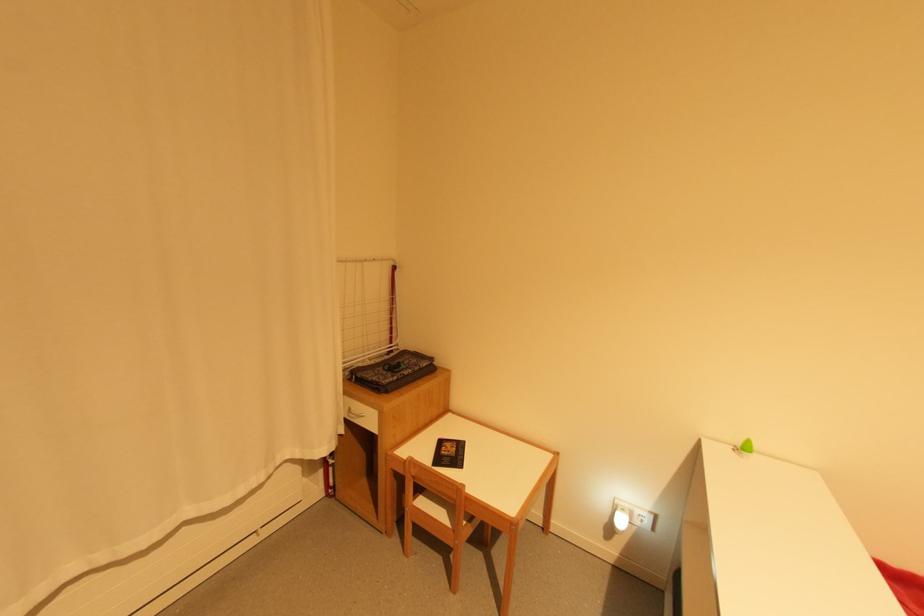
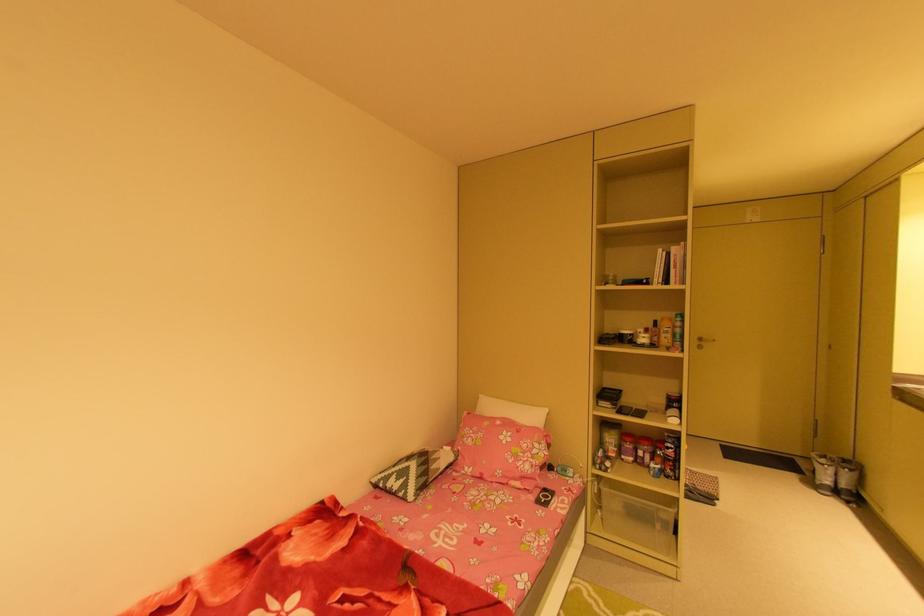
Question: The first image is from the beginning of the video and the second image is from the end. How did the camera likely rotate when shooting the video?

Choices:
 (A) Left
 (B) Right
 (C) Up
 (D) Down

Answer: (B)